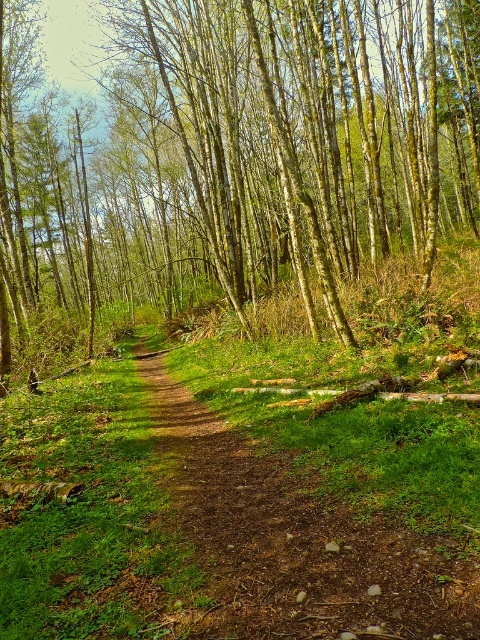
You are standing at the point marked by the coordinates point (235,161) in the forest scene. What object is located exactly at this point?

The point (235,161) indicates a brown smooth tree at center.

You are standing at the starting point of the dirt path in the forest. You want to locate the brown smooth tree at center. Based on the coordinates provided, in which direction should you walk to reach it?

The brown smooth tree at center is located at coordinates point (x=235, y=161). Since the path is in the center, you should walk straight ahead along the dirt path to reach it.

You are a hiker walking along the dirt path at center. You notice a brown smooth tree at center nearby. Which one is bigger in size?

The brown smooth tree at center is larger in size than the dirt path at center.